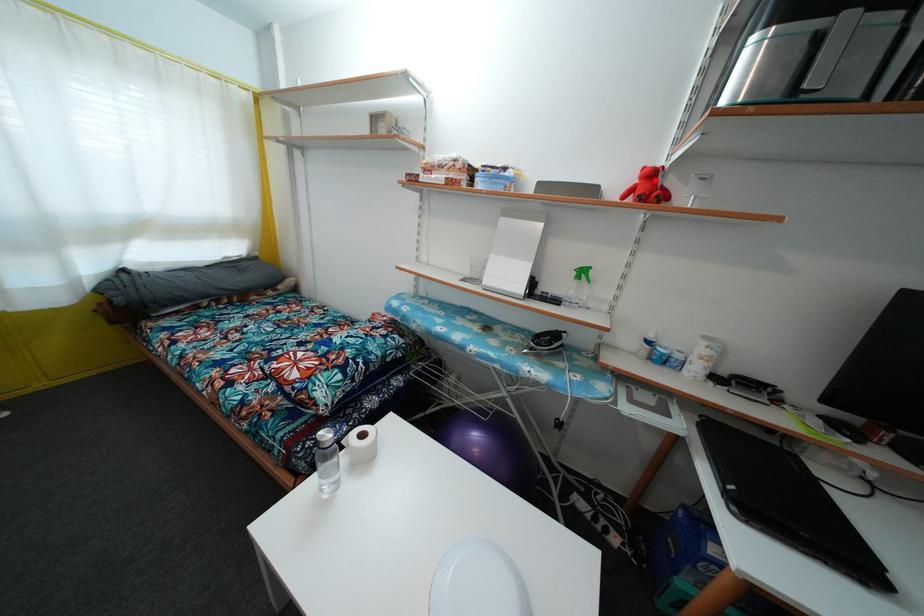
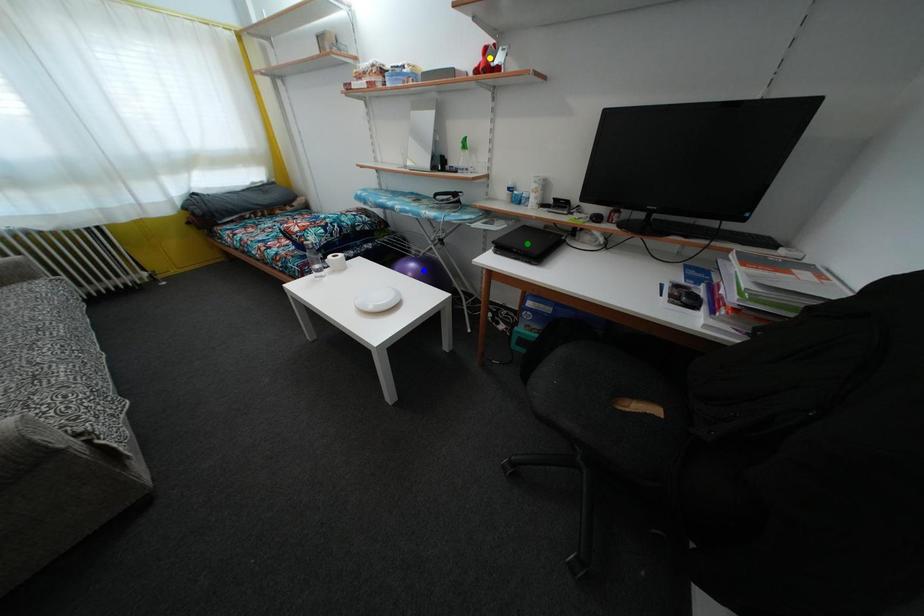
Question: I am providing you with two images of the same scene from different viewpoints. A red point is marked on the first image. You are given multiple points on the second image. Which mark in image 2 goes with the point in image 1?

Choices:
 (A) blue point
 (B) yellow point
 (C) green point

Answer: (B)